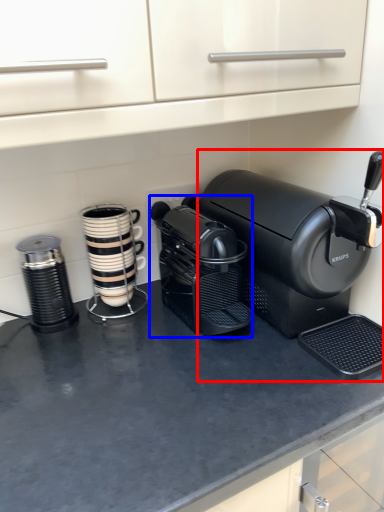
Question: Which object is further to the camera taking this photo, coffee maker (highlighted by a red box) or coffee maker (highlighted by a blue box)?

Choices:
 (A) coffee maker
 (B) coffee maker

Answer: (B)